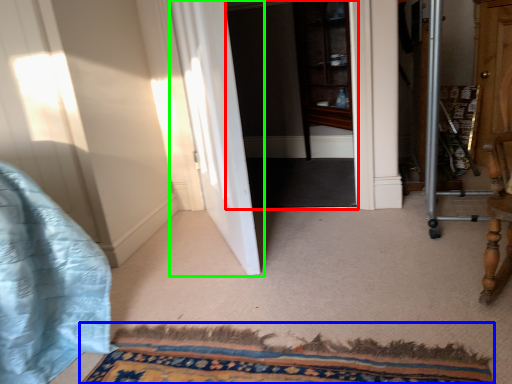
Question: Which object is positioned farthest from screen door (highlighted by a red box)? Select from doormat (highlighted by a blue box) and door (highlighted by a green box).

Choices:
 (A) doormat
 (B) door

Answer: (A)